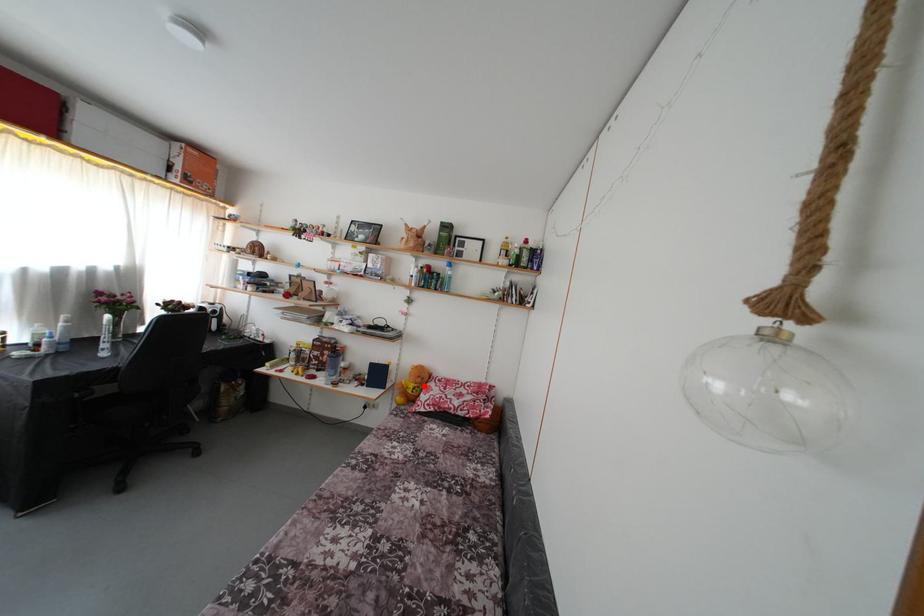
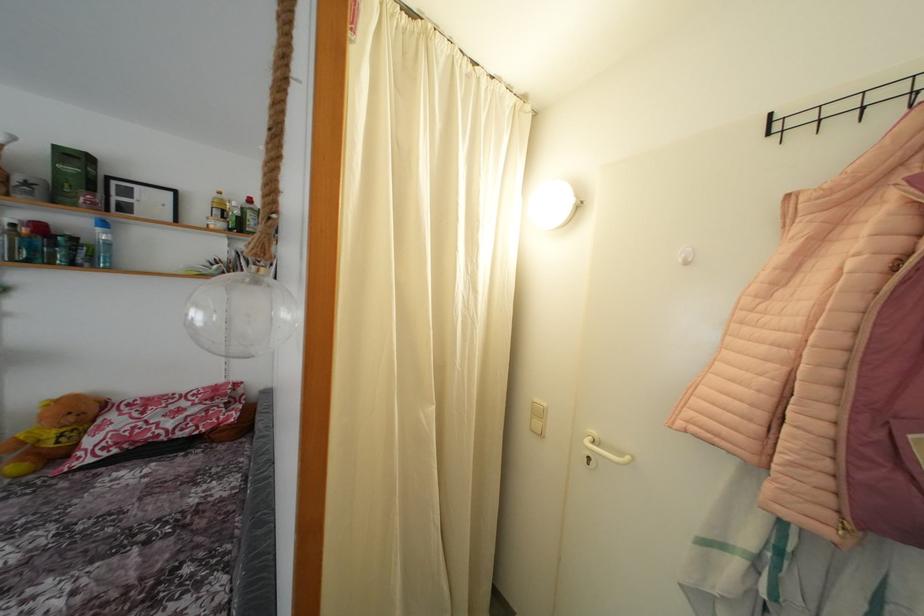
Question: I am providing you with two images of the same scene from different viewpoints. A red point is shown in image1. For the corresponding object point in image2, is it positioned nearer or farther from the camera?

Choices:
 (A) Nearer
 (B) Farther

Answer: (A)